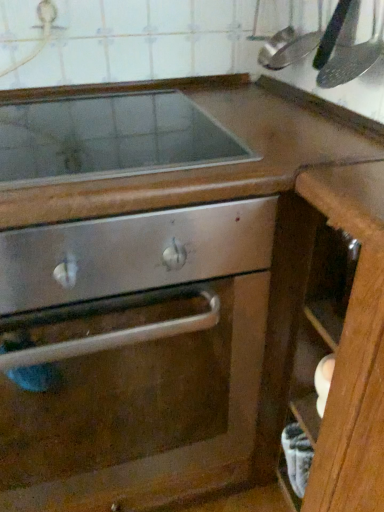
Question: Considering the relative positions of smooth stainless steel cooktop at upper center and stainless steel oven door at center in the image provided, is smooth stainless steel cooktop at upper center to the left or to the right of stainless steel oven door at center?

Choices:
 (A) right
 (B) left

Answer: (A)

Question: Considering the positions of point (177, 160) and point (127, 369), is point (177, 160) closer or farther from the camera than point (127, 369)?

Choices:
 (A) closer
 (B) farther

Answer: (A)

Question: Considering the real-world distances, which object is farthest from the brushed metal faucet at upper left?

Choices:
 (A) smooth stainless steel cooktop at upper center
 (B) stainless steel oven door at center
 (C) wooden drawer at lower right
 (D) metallic silver spatula at upper right

Answer: (B)

Question: Based on their relative distances, which object is farther from the stainless steel oven door at center?

Choices:
 (A) smooth stainless steel cooktop at upper center
 (B) wooden drawer at lower right
 (C) brushed metal faucet at upper left
 (D) metallic silver spatula at upper right

Answer: (C)